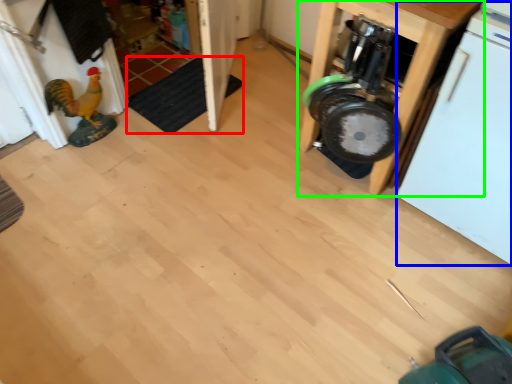
Question: Based on their relative distances, which object is nearer to mat (highlighted by a red box)? Choose from dish washer (highlighted by a blue box) and furniture (highlighted by a green box).

Choices:
 (A) dish washer
 (B) furniture

Answer: (B)